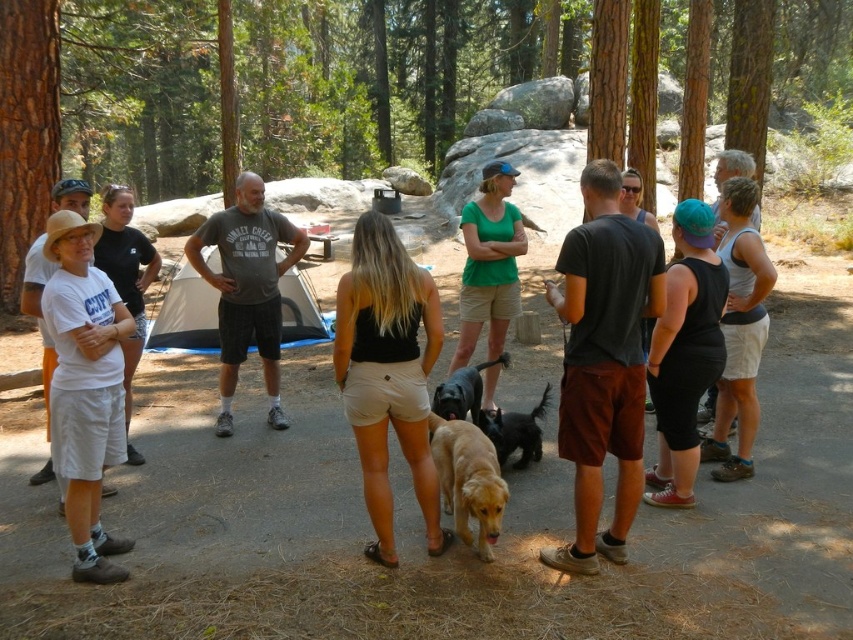
Question: Which point appears closest to the camera in this image?

Choices:
 (A) (540, 397)
 (B) (440, 387)
 (C) (445, 474)

Answer: (C)

Question: Can you confirm if golden fur dog at center is thinner than shiny black dog at center?

Choices:
 (A) yes
 (B) no

Answer: (A)

Question: Is the position of golden matte dog at center less distant than that of shiny black dog at center?

Choices:
 (A) no
 (B) yes

Answer: (B)

Question: Is golden matte dog at center positioned behind golden fur dog at center?

Choices:
 (A) no
 (B) yes

Answer: (A)

Question: Based on their relative distances, which object is farther from the golden matte dog at center?

Choices:
 (A) shiny black dog at center
 (B) golden fur dog at center

Answer: (B)

Question: Considering the real-world distances, which object is closest to the shiny black dog at center?

Choices:
 (A) golden fur dog at center
 (B) golden matte dog at center

Answer: (A)